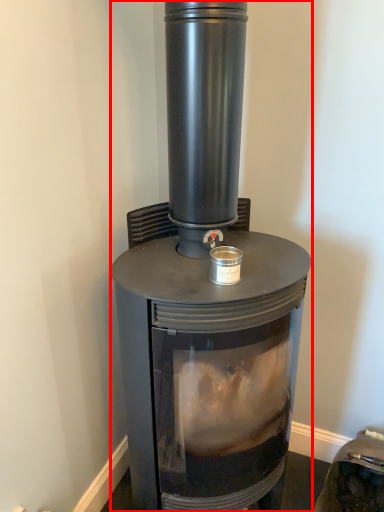
Question: Considering the relative positions of wood burning stove (annotated by the red box) and appliance in the image provided, where is wood burning stove (annotated by the red box) located with respect to the staircase?

Choices:
 (A) left
 (B) right

Answer: (A)